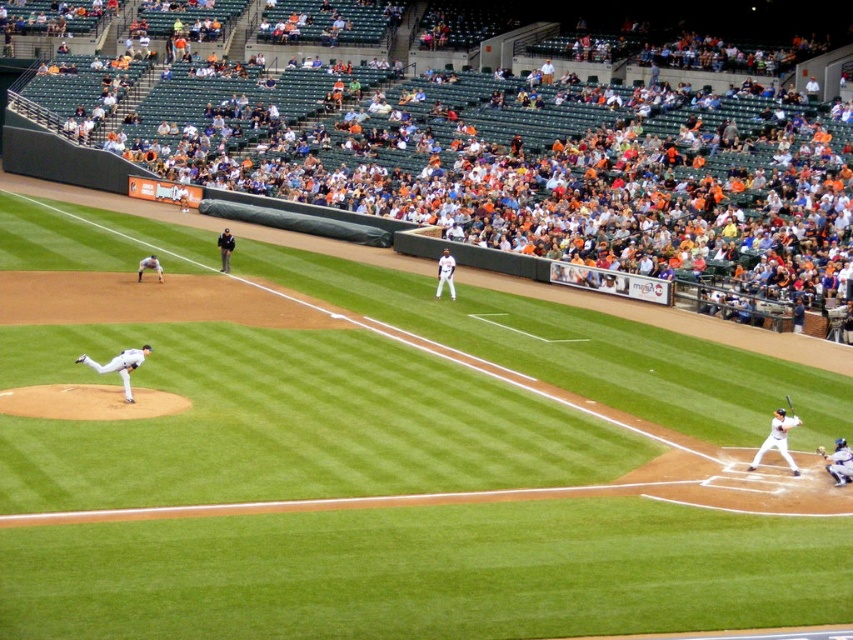
You are a drone operator trying to capture aerial footage of the baseball game. You need to position your drone to avoid the orange fabric seats at upper center. What coordinates should you avoid?

The orange fabric seats at upper center are located at coordinates point (520, 168). You should avoid this coordinate to prevent interference with the seats.

You are a drone operator trying to capture a clear aerial shot of the black fabric referee at upper center during the baseball game. However, there are orange fabric seats at upper center in the way. Can you adjust your drone to get an unobstructed view of the referee?

The orange fabric seats at upper center is positioned over black fabric referee at upper center, so the drone cannot get an unobstructed view of the referee without moving the seats.

In the scene shown: You are a photographer at the stadium and want to capture a photo that includes both the white uniform at center and the black fabric referee at upper center. Which one should you adjust your camera focus to ensure it appears closer in the photo?

To make the white uniform at center appear closer in the photo, adjust the camera focus on it since it is shorter than the black fabric referee at upper center.